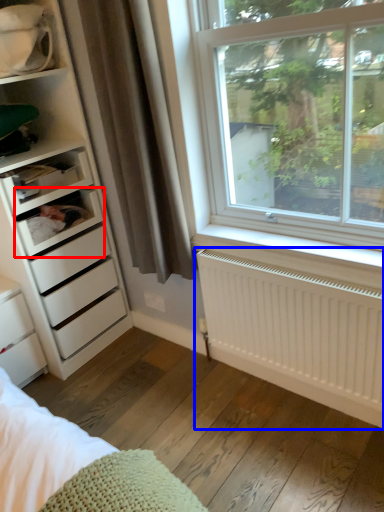
Question: Among these objects, which one is nearest to the camera, shelf (highlighted by a red box) or radiator (highlighted by a blue box)?

Choices:
 (A) shelf
 (B) radiator

Answer: (B)